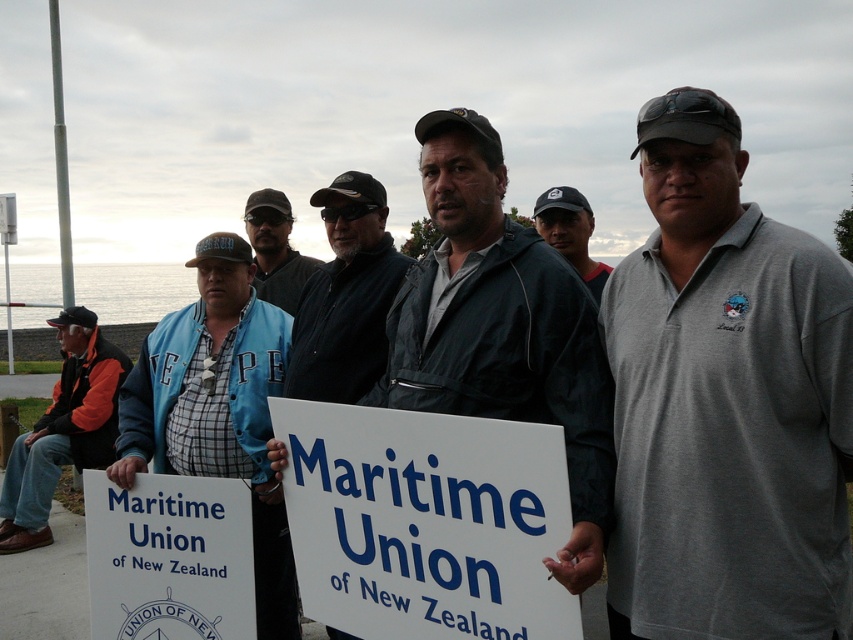
Question: Which point is closer to the camera?

Choices:
 (A) (99, 396)
 (B) (350, 339)
 (C) (537, 205)
 (D) (291, 276)

Answer: (B)

Question: Which point appears closest to the camera in this image?

Choices:
 (A) (152, 435)
 (B) (131, 576)
 (C) (514, 528)
 (D) (488, 364)

Answer: (C)

Question: Where is blue fabric jacket at center located in relation to dark blue jacket at center in the image?

Choices:
 (A) below
 (B) above

Answer: (A)

Question: Which point is farther to the camera?

Choices:
 (A) dark gray jacket at center
 (B) dark blue jacket at center
 (C) dark gray cap at center
 (D) orange fleece jacket at left

Answer: (D)

Question: Can you confirm if blue fabric jacket at center is bigger than dark gray cap at center?

Choices:
 (A) no
 (B) yes

Answer: (B)

Question: Observing the image, what is the correct spatial positioning of gray cotton polo shirt at center in reference to blue denim jacket at center?

Choices:
 (A) right
 (B) left

Answer: (A)